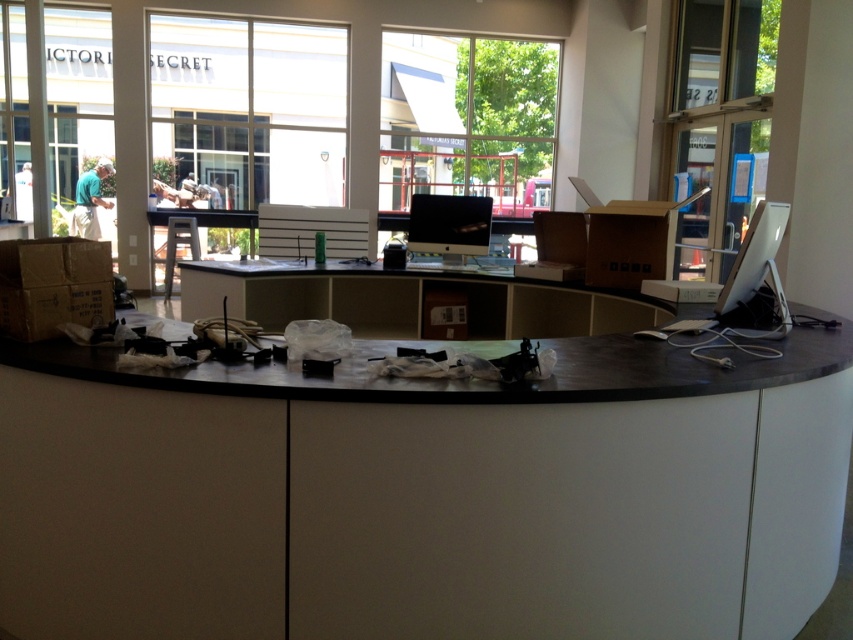
You are a customer entering the store and want to ask the staff a question. The matte black desk at center is where the staff is working. However, there is a satin silver monitor at right blocking your view. Can you see the staff clearly from where you are standing?

The satin silver monitor at right is behind the matte black desk at center, so it is positioned between you and the staff. This means the monitor may block your view, making it difficult to see the staff clearly.

You are a customer entering the store and want to ask the staff a question. You see the black matte desk at center and the satin silver monitor at right. Which object should you approach first to get assistance?

You should approach the black matte desk at center first because it is closer to you than the satin silver monitor at right, which is further away.